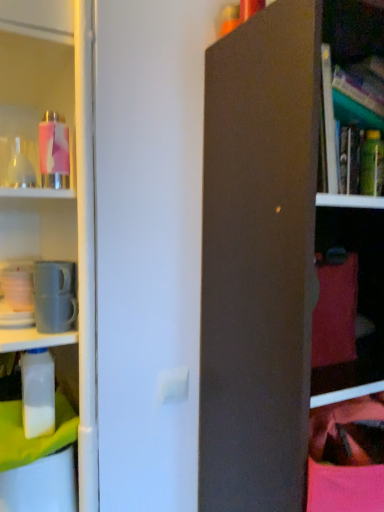
Question: Looking at the image, does white plastic bottle at left, which appears as the 2th bottle when viewed from the left, seem bigger or smaller compared to pink matte water bottle at upper left, which ranks as the fourth bottle in bottom-to-top order?

Choices:
 (A) big
 (B) small

Answer: (A)

Question: From their relative heights in the image, would you say white plastic bottle at left, the 1th bottle in the bottom-to-top sequence, is taller or shorter than pink matte water bottle at upper left, marked as the 1th bottle in a top-to-bottom arrangement?

Choices:
 (A) tall
 (B) short

Answer: (A)

Question: Estimate the real-world distances between objects in this image. Which object is closer to the pink matte water bottle at upper left, which ranks as the fourth bottle in bottom-to-top order?

Choices:
 (A) green matte bottle at upper right, the 1th bottle viewed from the right
 (B) translucent glass bottle at upper left, the first bottle viewed from the left
 (C) white plastic bottle at left, which appears as the 2th bottle when viewed from the left

Answer: (B)

Question: Considering the real-world distances, which object is farthest from the white plastic bottle at left, which appears as the 2th bottle when viewed from the left?

Choices:
 (A) green matte bottle at upper right, the second bottle from the top
 (B) translucent glass bottle at upper left, the first bottle viewed from the left
 (C) pink matte water bottle at upper left, which ranks as the fourth bottle in bottom-to-top order

Answer: (A)